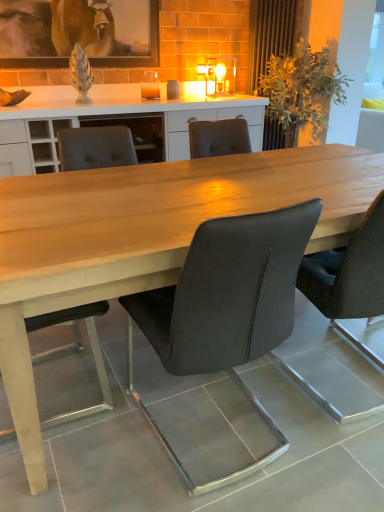
Question: Could you tell me if matte wooden picture frame at upper center is facing matte black chair at center, which ranks as the 2th chair in right-to-left order?

Choices:
 (A) yes
 (B) no

Answer: (B)

Question: Is matte wooden picture frame at upper center to the left of matte black chair at center, marked as the 2th chair in a left-to-right arrangement, from the viewer's perspective?

Choices:
 (A) yes
 (B) no

Answer: (A)

Question: Does matte wooden picture frame at upper center have a greater height compared to matte black chair at center, marked as the 2th chair in a left-to-right arrangement?

Choices:
 (A) yes
 (B) no

Answer: (B)

Question: Is matte wooden picture frame at upper center positioned before matte black chair at center, which ranks as the 2th chair in right-to-left order?

Choices:
 (A) no
 (B) yes

Answer: (A)

Question: Considering the relative sizes of matte wooden picture frame at upper center and matte black chair at center, marked as the 2th chair in a left-to-right arrangement, in the image provided, is matte wooden picture frame at upper center smaller than matte black chair at center, marked as the 2th chair in a left-to-right arrangement,?

Choices:
 (A) yes
 (B) no

Answer: (A)

Question: Does point (67, 3) appear closer or farther from the camera than point (327, 285)?

Choices:
 (A) farther
 (B) closer

Answer: (A)

Question: From a real-world perspective, relative to matte black chair at center, positioned as the 1th chair in right-to-left order, is matte wooden picture frame at upper center vertically above or below?

Choices:
 (A) above
 (B) below

Answer: (A)

Question: Considering the relative positions of matte wooden picture frame at upper center and matte black chair at center, which is counted as the 3th chair, starting from the left, in the image provided, is matte wooden picture frame at upper center to the left or to the right of matte black chair at center, which is counted as the 3th chair, starting from the left,?

Choices:
 (A) left
 (B) right

Answer: (A)

Question: Considering their positions, is matte wooden picture frame at upper center located in front of or behind matte black chair at center, which is counted as the 3th chair, starting from the left?

Choices:
 (A) front
 (B) behind

Answer: (B)

Question: Visually, is light wood table at center positioned to the left or to the right of matte black chair at center, which appears as the third chair when viewed from the right?

Choices:
 (A) right
 (B) left

Answer: (A)

Question: From the image's perspective, is light wood table at center positioned above or below matte black chair at center, the 1th chair viewed from the left?

Choices:
 (A) below
 (B) above

Answer: (B)

Question: Is point (31, 415) positioned closer to the camera than point (72, 154)?

Choices:
 (A) farther
 (B) closer

Answer: (B)

Question: Is light wood table at center situated inside matte black chair at center, which appears as the third chair when viewed from the right, or outside?

Choices:
 (A) inside
 (B) outside

Answer: (B)

Question: In terms of width, does matte black chair at center, positioned as the 1th chair in right-to-left order, look wider or thinner when compared to matte wooden picture frame at upper center?

Choices:
 (A) wide
 (B) thin

Answer: (A)

Question: Visually, is matte black chair at center, positioned as the 1th chair in right-to-left order, positioned to the left or to the right of matte wooden picture frame at upper center?

Choices:
 (A) left
 (B) right

Answer: (B)